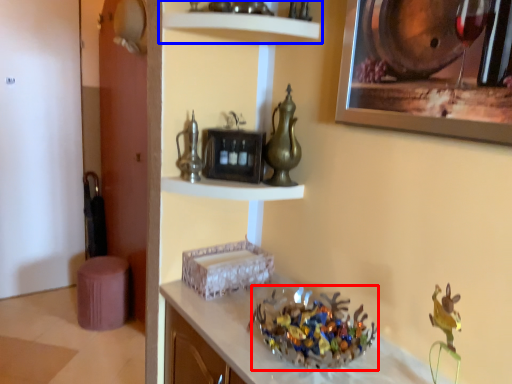
Question: Among these objects, which one is farthest to the camera, collection (highlighted by a red box) or shelf (highlighted by a blue box)?

Choices:
 (A) collection
 (B) shelf

Answer: (B)